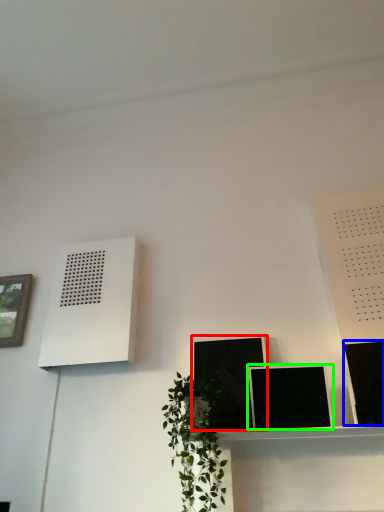
Question: Which object is positioned closest to picture frame (highlighted by a red box)? Select from picture frame (highlighted by a blue box) and picture frame (highlighted by a green box).

Choices:
 (A) picture frame
 (B) picture frame

Answer: (B)